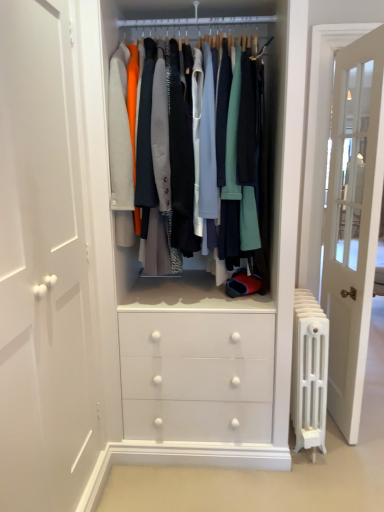
Question: Is matte white clothes at center wider or thinner than white metal radiator at right?

Choices:
 (A) wide
 (B) thin

Answer: (B)

Question: Is matte white clothes at center taller or shorter than white metal radiator at right?

Choices:
 (A) tall
 (B) short

Answer: (A)

Question: Considering the real-world distances, which object is farthest from the white metal radiator at right?

Choices:
 (A) matte white clothes at center
 (B) white glass door at right

Answer: (A)

Question: Which of these objects is positioned closest to the matte white clothes at center?

Choices:
 (A) white glass door at right
 (B) white metal radiator at right

Answer: (B)